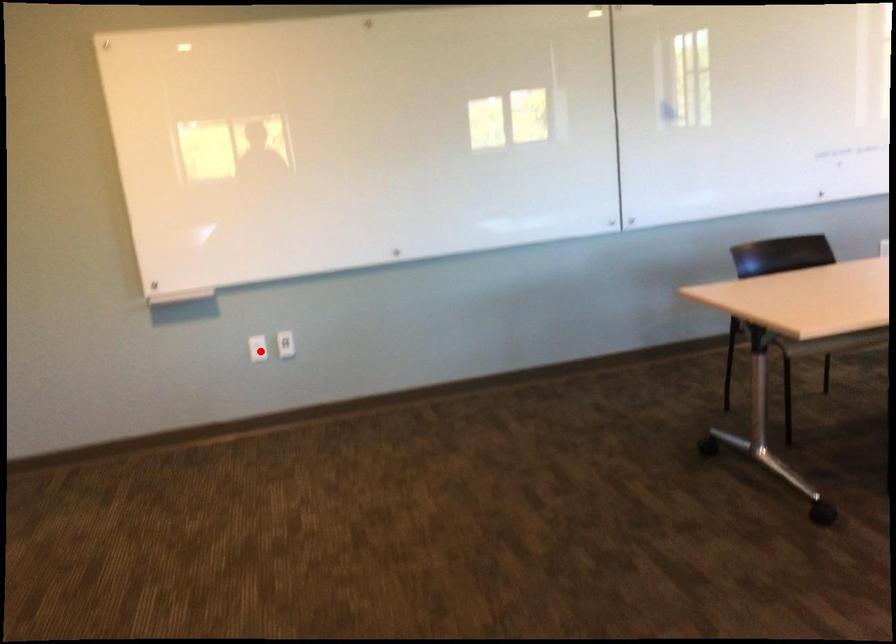
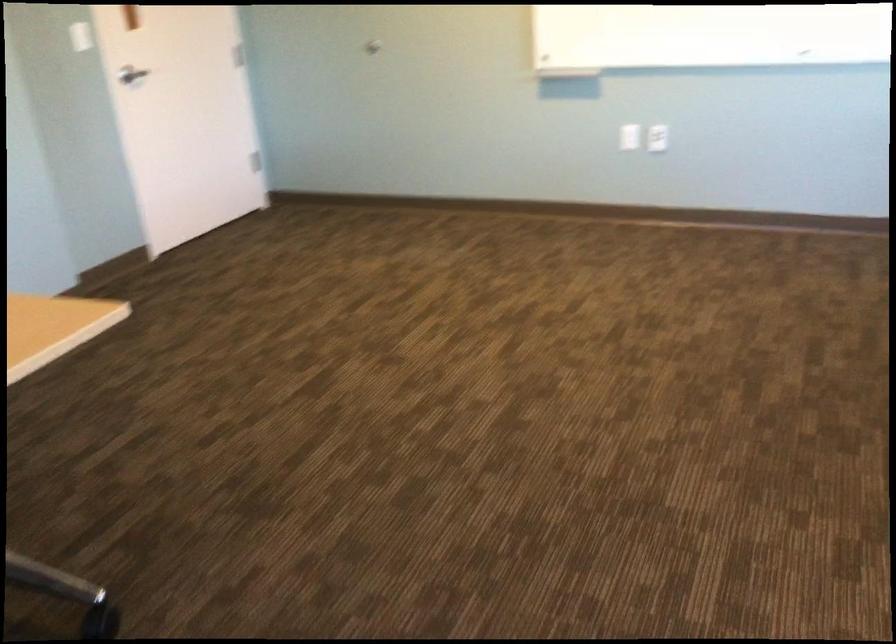
Question: I am providing you with two images of the same scene from different viewpoints. A red point is marked on the first image. Is the red point's position out of view in image 2?

Choices:
 (A) Yes
 (B) No

Answer: (B)